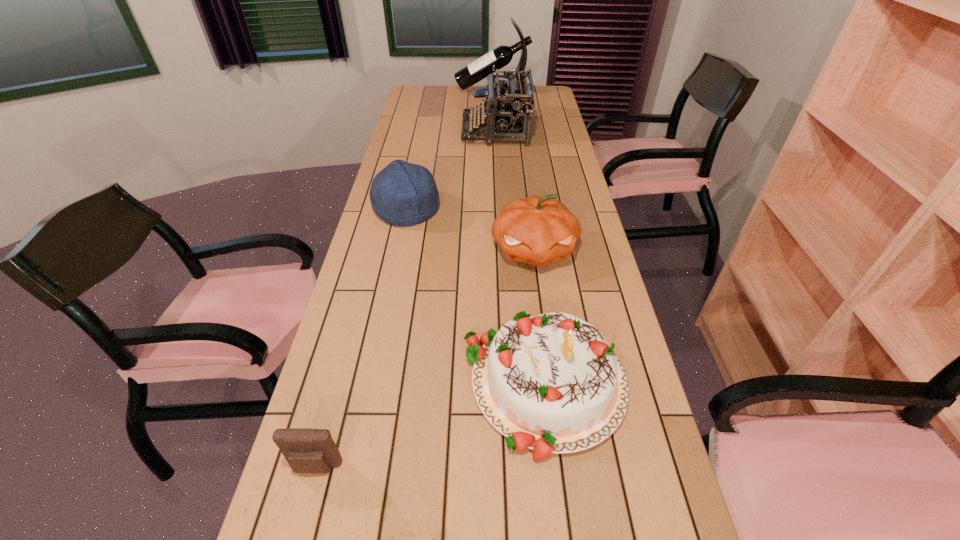
At what (x,y) coordinates should I click in order to perform the action: click on wine bottle. Please return your answer as a coordinate pair (x, y). The height and width of the screenshot is (540, 960). Looking at the image, I should click on (501, 56).

Identify the location of the tallest object. (501, 56).

Image resolution: width=960 pixels, height=540 pixels. I want to click on typewriter, so click(510, 114).

Identify the location of pumpkin. (536, 230).

This screenshot has width=960, height=540. I want to click on cake, so click(x=551, y=383).

This screenshot has width=960, height=540. I want to click on skullcap, so coord(403,194).

Where is `pouch`? pouch is located at coordinates (307, 450).

At what (x,y) coordinates should I click in order to perform the action: click on vacant position located 0.200m on the stand of the wine bottle. Please return your answer as a coordinate pair (x, y). The height and width of the screenshot is (540, 960). Looking at the image, I should click on (416, 94).

This screenshot has height=540, width=960. In order to click on vacant space located on the stand of the wine bottle in this screenshot , I will do `click(444, 94)`.

At what (x,y) coordinates should I click in order to perform the action: click on free space located 0.090m on the stand of the wine bottle. Please return your answer as a coordinate pair (x, y). This screenshot has width=960, height=540. Looking at the image, I should click on (437, 94).